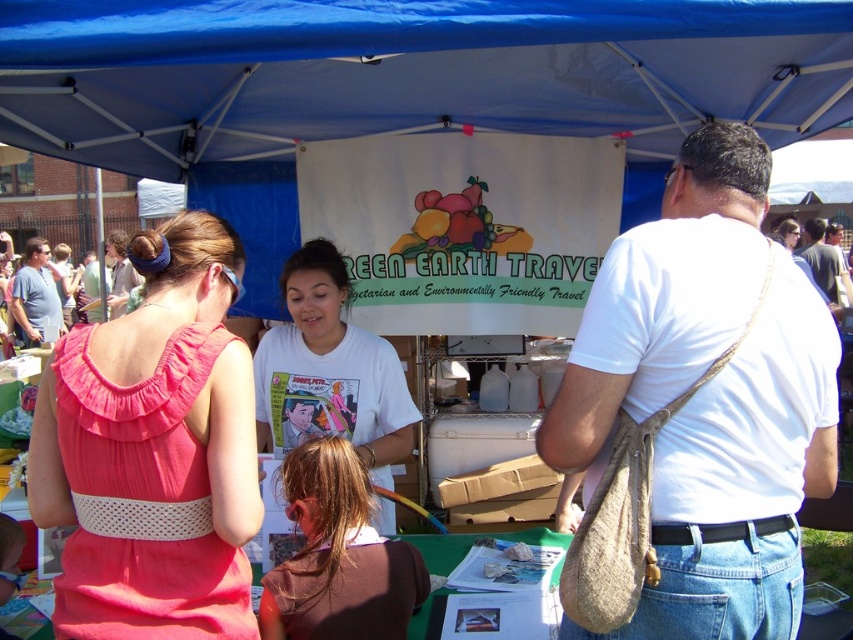
Does point (263, 616) lie behind point (114, 298)?

That is False.

At what (x,y) coordinates should I click in order to perform the action: click on brown hair at center. Please return your answer as a coordinate pair (x, y). Looking at the image, I should click on (338, 556).

Find the location of a particular element. This screenshot has height=640, width=853. brown hair at center is located at coordinates (338, 556).

Does white cotton t-shirt at center have a lesser width compared to matte pink dress at center?

Yes.

Who is more forward, (x=322, y=392) or (x=115, y=296)?

Point (x=322, y=392) is in front.

In order to click on white cotton t-shirt at center in this screenshot , I will do `click(329, 371)`.

The width and height of the screenshot is (853, 640). I want to click on white cotton t-shirt at center, so click(x=329, y=371).

Describe the element at coordinates (329, 371) in the screenshot. I see `white cotton t-shirt at center` at that location.

Between white cotton t-shirt at center and matte blue shirt at left, which one has more height?

matte blue shirt at left

The height and width of the screenshot is (640, 853). What are the coordinates of `white cotton t-shirt at center` in the screenshot? It's located at (329, 371).